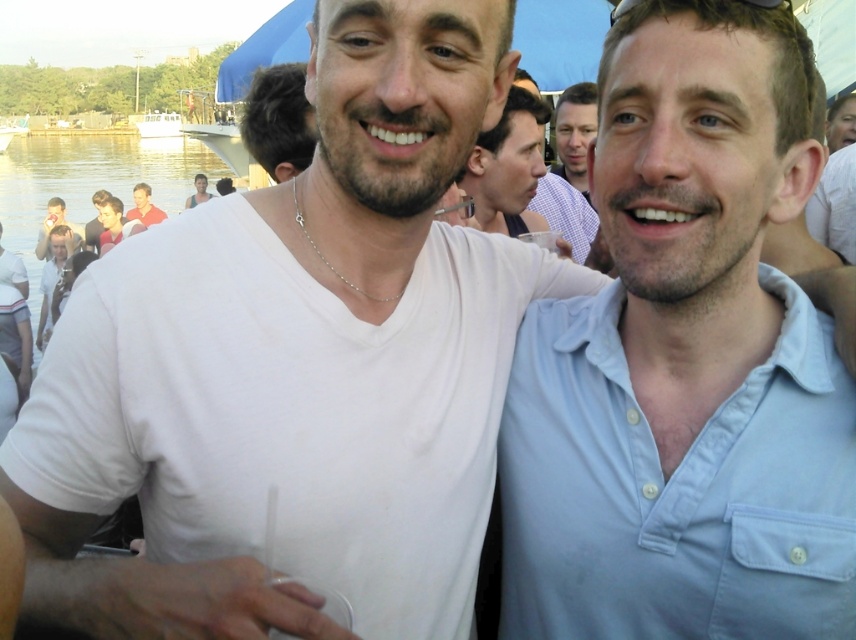
You are at a party by the waterfront and notice two people in the upper left corner of the scene. The two people have dark brown hair at upper left and matte black hair at upper left. Which one is positioned more to the left?

The matte black hair at upper left is positioned more to the left because the dark brown hair at upper left is to the right of it.